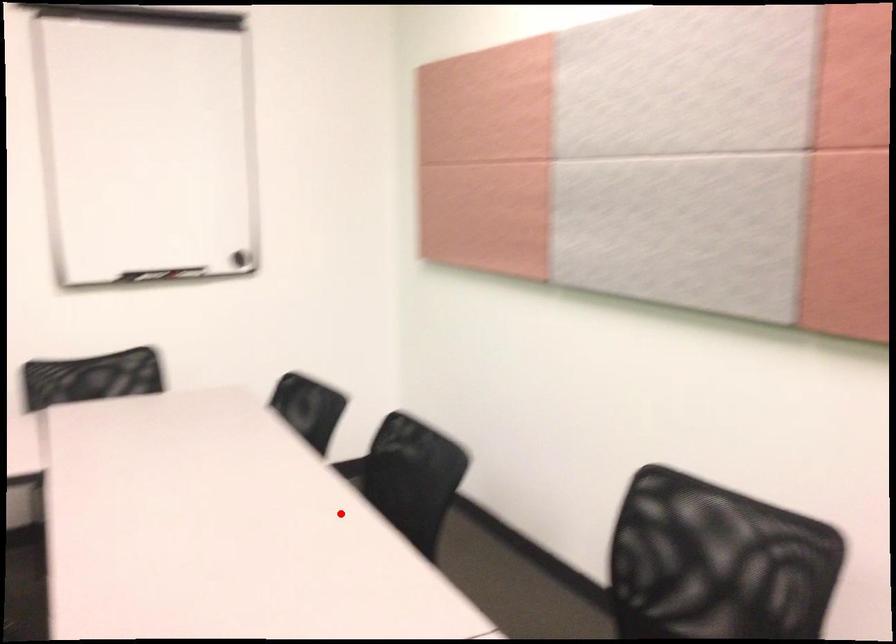
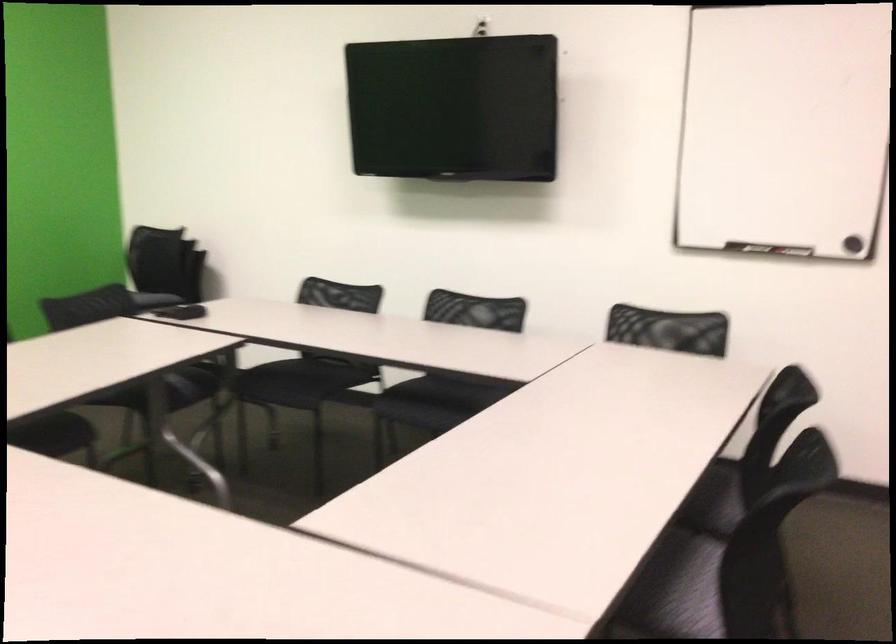
Find the pixel in the second image that matches the highlighted location in the first image.

(722, 491)